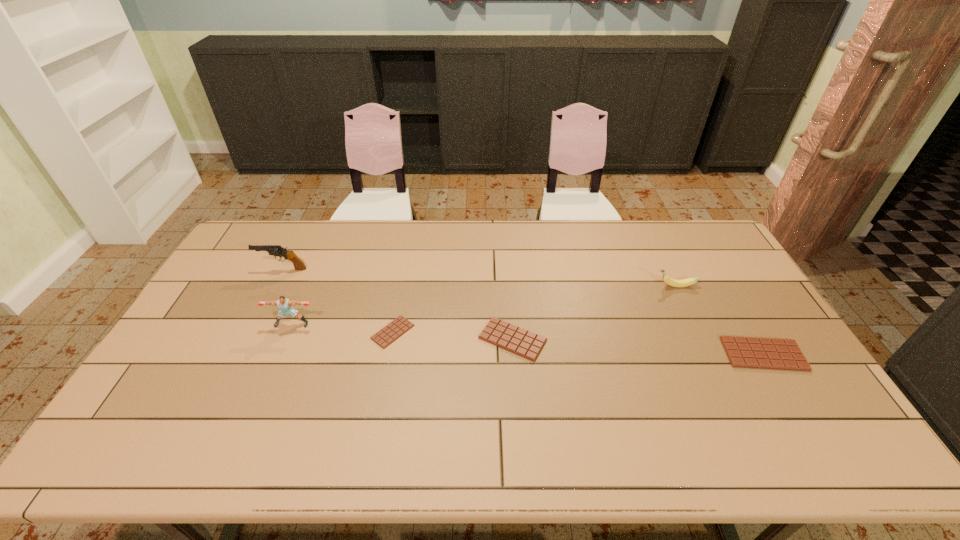
You are a GUI agent. You are given a task and a screenshot of the screen. Output one action in this format:
    pyautogui.click(x=<x>, y=<y>)
    Task: Click on the free space between the fourth object from right to left and the puncher
    The height and width of the screenshot is (540, 960).
    Given the screenshot: What is the action you would take?
    pyautogui.click(x=343, y=328)

At what (x,y) coordinates should I click in order to perform the action: click on vacant region between the shortest candy bar and the rightmost candy bar. Please return your answer as a coordinate pair (x, y). Looking at the image, I should click on (578, 343).

Identify the location of unoccupied area between the second tallest candy bar and the farthest object. The width and height of the screenshot is (960, 540). (397, 304).

Locate an element on the screen. empty location between the rightmost candy bar and the fifth tallest object is located at coordinates (637, 347).

I want to click on free space between the gun and the banana, so (x=478, y=278).

Identify the location of vacant area between the banana and the rightmost candy bar. (719, 320).

Where is `unoccupied position between the third tallest object and the farthest object`? Image resolution: width=960 pixels, height=540 pixels. unoccupied position between the third tallest object and the farthest object is located at coordinates (478, 278).

Point out which object is positioned as the fourth nearest to the rightmost candy bar. Please provide its 2D coordinates. Your answer should be formatted as a tuple, i.e. [(x, y)], where the tuple contains the x and y coordinates of a point satisfying the conditions above.

[(284, 304)]

Identify which object is located as the fourth nearest to the farthest object. Please provide its 2D coordinates. Your answer should be formatted as a tuple, i.e. [(x, y)], where the tuple contains the x and y coordinates of a point satisfying the conditions above.

[(669, 281)]

Locate which candy bar is the closest to the rightmost candy bar. Please provide its 2D coordinates. Your answer should be formatted as a tuple, i.e. [(x, y)], where the tuple contains the x and y coordinates of a point satisfying the conditions above.

[(524, 343)]